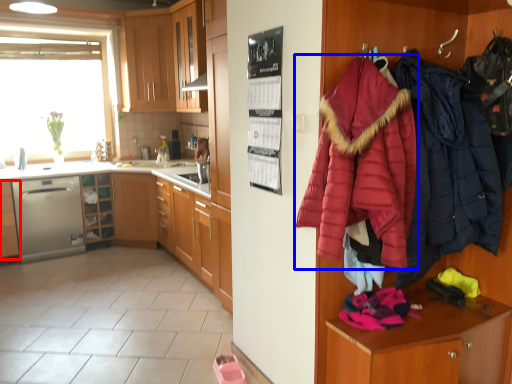
Question: Which of the following is the closest to the observer, cabinetry (highlighted by a red box) or jacket (highlighted by a blue box)?

Choices:
 (A) cabinetry
 (B) jacket

Answer: (B)